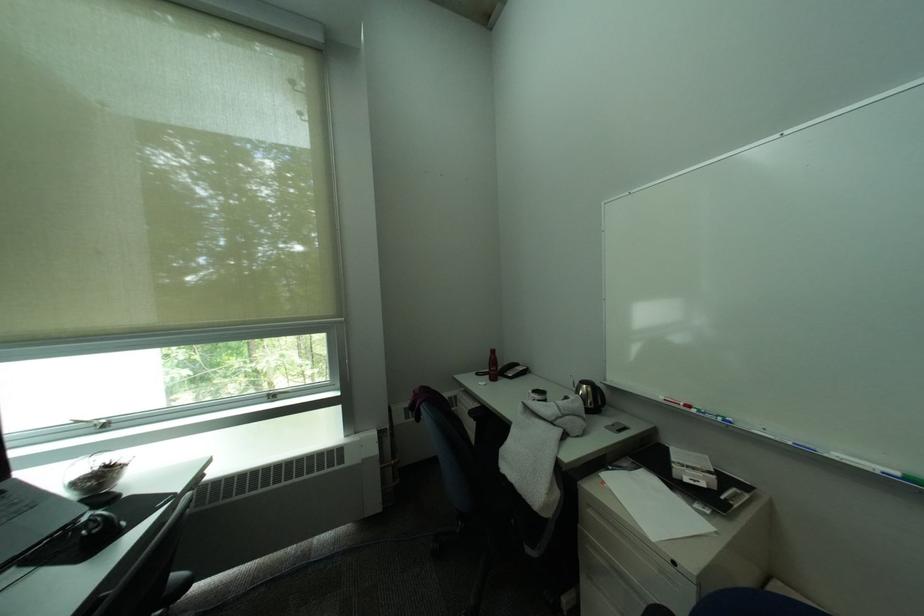
Find where to lift the small glass bowl. Please return your answer as a coordinate pair (x, y).

(94, 474)